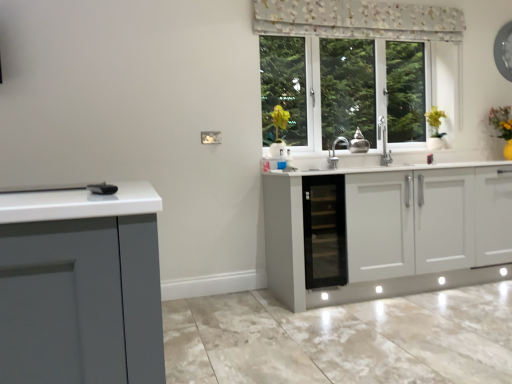
Question: Is black glass cabinet at center situated inside floral fabric curtain at upper center or outside?

Choices:
 (A) inside
 (B) outside

Answer: (B)

Question: Considering the positions of black glass cabinet at center and floral fabric curtain at upper center in the image, is black glass cabinet at center wider or thinner than floral fabric curtain at upper center?

Choices:
 (A) wide
 (B) thin

Answer: (A)

Question: Which is farther from the black glass cabinet at center?

Choices:
 (A) yellow matte plant at upper right
 (B) floral fabric curtain at upper center

Answer: (A)

Question: Which object is the farthest from the black glass cabinet at center?

Choices:
 (A) yellow matte plant at upper right
 (B) floral fabric curtain at upper center

Answer: (A)